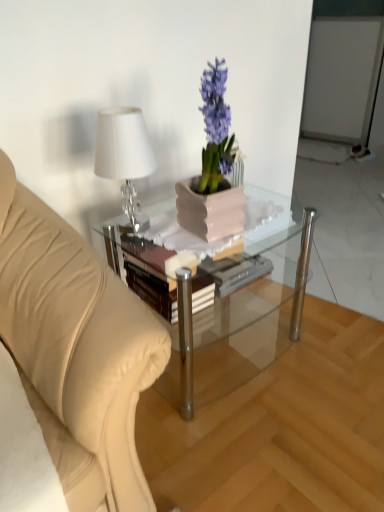
Question: Looking at the image, does hardcover book at center seem bigger or smaller compared to clear glass coffee table at center?

Choices:
 (A) small
 (B) big

Answer: (A)

Question: Considering the positions of point (122, 244) and point (264, 304), is point (122, 244) closer or farther from the camera than point (264, 304)?

Choices:
 (A) farther
 (B) closer

Answer: (B)

Question: Considering the real-world distances, which object is farthest from the clear glass coffee table at center?

Choices:
 (A) matte pink pot at center
 (B) shiny silver table lamp at upper left
 (C) hardcover book at center

Answer: (B)

Question: Estimate the real-world distances between objects in this image. Which object is farther from the matte pink pot at center?

Choices:
 (A) hardcover book at center
 (B) shiny silver table lamp at upper left
 (C) clear glass coffee table at center

Answer: (C)